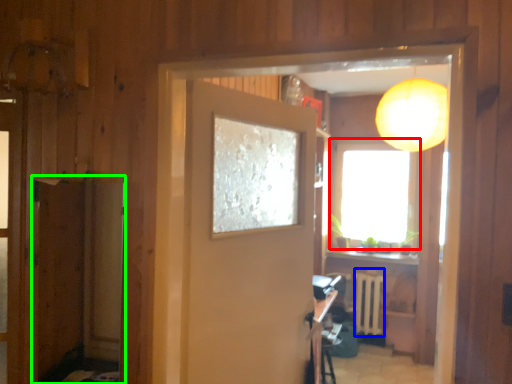
Question: Which object is the closest to the window (highlighted by a red box)? Choose among these: radiator (highlighted by a blue box) or screen door (highlighted by a green box).

Choices:
 (A) radiator
 (B) screen door

Answer: (A)